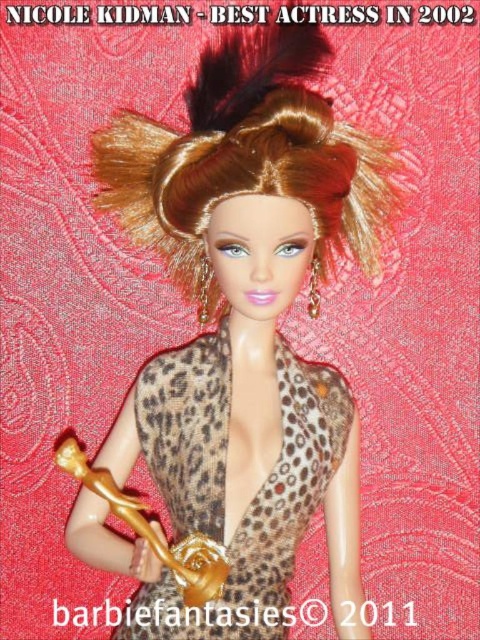
Does shiny brown hair at center have a larger size compared to leopard print fabric dress at center?

Indeed, shiny brown hair at center has a larger size compared to leopard print fabric dress at center.

Who is more forward, (309, 122) or (301, 374)?

Point (309, 122)

The height and width of the screenshot is (640, 480). I want to click on shiny brown hair at center, so click(x=247, y=161).